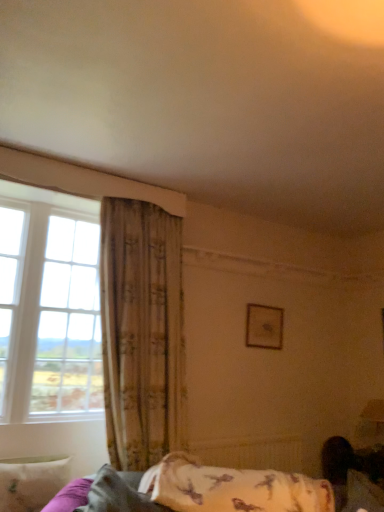
I want to click on wooden frame at upper center, so click(x=264, y=327).

Where is `white matte radiator at lower center`? This screenshot has width=384, height=512. white matte radiator at lower center is located at coordinates (251, 453).

Describe the element at coordinates (251, 453) in the screenshot. I see `white matte radiator at lower center` at that location.

The width and height of the screenshot is (384, 512). Describe the element at coordinates (83, 180) in the screenshot. I see `clear glass window at left` at that location.

This screenshot has height=512, width=384. What do you see at coordinates (363, 493) in the screenshot? I see `fluffy white pillow at lower right, which is counted as the first pillow, starting from the right` at bounding box center [363, 493].

In order to face fluffy white pillow at lower center, the second pillow from the right, should I rotate leftwards or rightwards?

To align with it, rotate left about 8.214°.

Locate an element on the screen. This screenshot has width=384, height=512. wooden frame at upper center is located at coordinates (264, 327).

In the scene shown: Is clear glass window at left spatially inside textured beige curtain at left, or outside of it?

The correct answer is: outside.

In the scene shown: Is clear glass window at left thinner than textured beige curtain at left?

In fact, clear glass window at left might be wider than textured beige curtain at left.

Can you confirm if clear glass window at left is positioned to the left of textured beige curtain at left?

Correct, you'll find clear glass window at left to the left of textured beige curtain at left.

Considering the sizes of objects clear glass window at left and textured beige curtain at left in the image provided, who is taller, clear glass window at left or textured beige curtain at left?

textured beige curtain at left.

Between fluffy white pillow at lower center, which is the 2th pillow from left to right, and white matte radiator at lower center, which one is positioned behind?

white matte radiator at lower center is more distant.

Would you say fluffy white pillow at lower center, the second pillow from the right, is to the left or to the right of white matte radiator at lower center in the picture?

Clearly, fluffy white pillow at lower center, the second pillow from the right, is on the left of white matte radiator at lower center in the image.

In the scene shown: From the image's perspective, which is above, fluffy white pillow at lower center, which is the 2th pillow from left to right, or white matte radiator at lower center?

fluffy white pillow at lower center, which is the 2th pillow from left to right, appears higher in the image.

Is fluffy white pillow at lower center, which is the 2th pillow from left to right, oriented towards white matte radiator at lower center?

No.

Which object is closer to the camera taking this photo, fluffy white pillow at lower right, which is counted as the first pillow, starting from the right, or white soft pillow at lower left, arranged as the third pillow when viewed from the right?

fluffy white pillow at lower right, which is counted as the first pillow, starting from the right, is more forward.

From a real-world perspective, does fluffy white pillow at lower right, which is the third pillow in left-to-right order, stand above white soft pillow at lower left, which is the 1th pillow in left-to-right order?

Yes, from a real-world perspective, fluffy white pillow at lower right, which is the third pillow in left-to-right order, is over white soft pillow at lower left, which is the 1th pillow in left-to-right order

What's the angular difference between fluffy white pillow at lower right, which is the third pillow in left-to-right order, and white soft pillow at lower left, arranged as the third pillow when viewed from the right,'s facing directions?

There is a 119-degree angle between the facing directions of fluffy white pillow at lower right, which is the third pillow in left-to-right order, and white soft pillow at lower left, arranged as the third pillow when viewed from the right.

Who is taller, fluffy white pillow at lower right, which is the third pillow in left-to-right order, or white soft pillow at lower left, which is the 1th pillow in left-to-right order?

white soft pillow at lower left, which is the 1th pillow in left-to-right order.

In the scene shown: Is textured beige curtain at left facing away from fluffy white pillow at lower center, the second pillow from the right?

No.

Which is in front, point (154, 324) or point (142, 507)?

Positioned in front is point (142, 507).

Is textured beige curtain at left inside the boundaries of fluffy white pillow at lower center, the second pillow from the right, or outside?

The correct answer is: outside.

Which object is positioned more to the left, textured beige curtain at left or fluffy white pillow at lower center, which is the 2th pillow from left to right?

textured beige curtain at left is more to the left.

Does point (282, 320) lie in front of point (181, 377)?

No.

How much distance is there between wooden frame at upper center and textured beige curtain at left?

The distance of wooden frame at upper center from textured beige curtain at left is 3.63 feet.

Considering the sizes of wooden frame at upper center and textured beige curtain at left in the image, is wooden frame at upper center bigger or smaller than textured beige curtain at left?

Clearly, wooden frame at upper center is smaller in size than textured beige curtain at left.

In the scene shown: Who is taller, white matte radiator at lower center or fluffy white pillow at lower right, which is counted as the first pillow, starting from the right?

With more height is white matte radiator at lower center.

Is white matte radiator at lower center not near fluffy white pillow at lower right, which is counted as the first pillow, starting from the right?

Yes, white matte radiator at lower center and fluffy white pillow at lower right, which is counted as the first pillow, starting from the right, are quite far apart.

Does white matte radiator at lower center have a larger size compared to fluffy white pillow at lower right, which is the third pillow in left-to-right order?

Indeed, white matte radiator at lower center has a larger size compared to fluffy white pillow at lower right, which is the third pillow in left-to-right order.

Between white matte radiator at lower center and fluffy white pillow at lower right, which is counted as the first pillow, starting from the right, which one appears on the left side from the viewer's perspective?

white matte radiator at lower center is more to the left.

From a real-world perspective, who is located lower, wooden frame at upper center or white matte radiator at lower center?

white matte radiator at lower center is physically lower.

Image resolution: width=384 pixels, height=512 pixels. What are the coordinates of `picture frame above the white matte radiator at lower center (from the image's perspective)` in the screenshot? It's located at (264, 327).

Considering the relative sizes of wooden frame at upper center and white matte radiator at lower center in the image provided, is wooden frame at upper center thinner than white matte radiator at lower center?

Correct, the width of wooden frame at upper center is less than that of white matte radiator at lower center.

This screenshot has height=512, width=384. Identify the location of window located above the textured beige curtain at left (from the image's perspective). (83, 180).

From a real-world perspective, which pillow is the 1st one above the white matte radiator at lower center? Please provide its 2D coordinates.

[(118, 493)]

Looking at this image, when comparing their distances from clear glass window at left, does fluffy white pillow at lower center, which is the 2th pillow from left to right, or white matte radiator at lower center seem further?

white matte radiator at lower center.

Estimate the real-world distances between objects in this image. Which object is closer to clear glass window at left, white soft pillow at lower left, arranged as the third pillow when viewed from the right, or white matte radiator at lower center?

Among the two, white soft pillow at lower left, arranged as the third pillow when viewed from the right, is located nearer to clear glass window at left.

Looking at the image, which one is located closer to fluffy white pillow at lower right, which is the third pillow in left-to-right order, fluffy white pillow at lower center, the second pillow from the right, or white soft pillow at lower left, arranged as the third pillow when viewed from the right?

The object closer to fluffy white pillow at lower right, which is the third pillow in left-to-right order, is fluffy white pillow at lower center, the second pillow from the right.

Looking at the image, which one is located further to fluffy white pillow at lower center, which is the 2th pillow from left to right, fluffy white pillow at lower right, which is counted as the first pillow, starting from the right, or white soft pillow at lower left, which is the 1th pillow in left-to-right order?

fluffy white pillow at lower right, which is counted as the first pillow, starting from the right, is positioned further to the anchor fluffy white pillow at lower center, which is the 2th pillow from left to right.

Considering their positions, is fluffy white pillow at lower center, which is the 2th pillow from left to right, positioned further to clear glass window at left than fluffy white pillow at lower right, which is counted as the first pillow, starting from the right?

fluffy white pillow at lower right, which is counted as the first pillow, starting from the right.

Considering their positions, is fluffy white pillow at lower right, which is counted as the first pillow, starting from the right, positioned further to fluffy white pillow at lower center, which is the 2th pillow from left to right, than white matte radiator at lower center?

Among the two, fluffy white pillow at lower right, which is counted as the first pillow, starting from the right, is located further to fluffy white pillow at lower center, which is the 2th pillow from left to right.

In the scene shown: From the image, which object appears to be farther from fluffy white pillow at lower right, which is counted as the first pillow, starting from the right, fluffy white pillow at lower center, the second pillow from the right, or white matte radiator at lower center?

The object further to fluffy white pillow at lower right, which is counted as the first pillow, starting from the right, is fluffy white pillow at lower center, the second pillow from the right.

From the image, which object appears to be nearer to wooden frame at upper center, fluffy white pillow at lower center, the second pillow from the right, or fluffy white pillow at lower right, which is the third pillow in left-to-right order?

fluffy white pillow at lower right, which is the third pillow in left-to-right order, lies closer to wooden frame at upper center than the other object.

Locate an element on the screen. The image size is (384, 512). curtain between white soft pillow at lower left, arranged as the third pillow when viewed from the right, and white matte radiator at lower center is located at coordinates (140, 330).

Where is `radiator between white soft pillow at lower left, arranged as the third pillow when viewed from the right, and fluffy white pillow at lower right, which is the third pillow in left-to-right order`? This screenshot has height=512, width=384. radiator between white soft pillow at lower left, arranged as the third pillow when viewed from the right, and fluffy white pillow at lower right, which is the third pillow in left-to-right order is located at coordinates (251, 453).

The height and width of the screenshot is (512, 384). Find the location of `curtain between clear glass window at left and wooden frame at upper center in the horizontal direction`. curtain between clear glass window at left and wooden frame at upper center in the horizontal direction is located at coordinates (140, 330).

Find the location of a particular element. curtain between white soft pillow at lower left, which is the 1th pillow in left-to-right order, and fluffy white pillow at lower right, which is the third pillow in left-to-right order, in the horizontal direction is located at coordinates (140, 330).